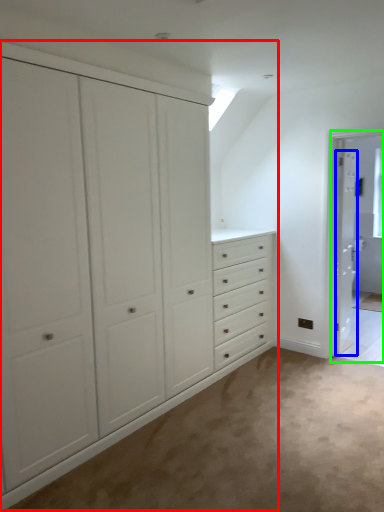
Question: Considering the real-world distances, which object is farthest from cupboard (highlighted by a red box)? door (highlighted by a blue box) or screen door (highlighted by a green box)?

Choices:
 (A) door
 (B) screen door

Answer: (A)